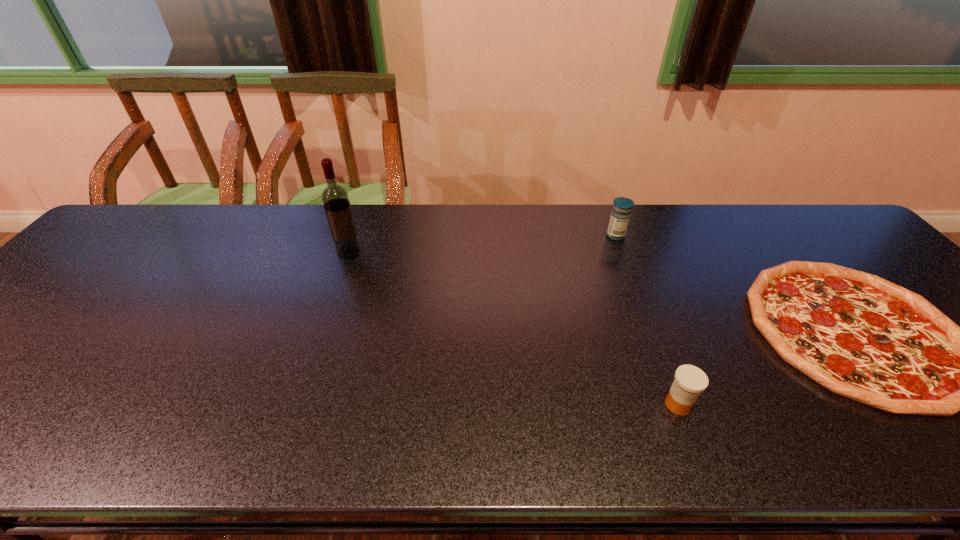
Where is `vacant space that is in between the farthest object and the second farthest object`? Image resolution: width=960 pixels, height=540 pixels. vacant space that is in between the farthest object and the second farthest object is located at coordinates (482, 244).

In order to click on vacant point located between the farthest object and the wine bottle in this screenshot , I will do `click(482, 244)`.

Find the location of a particular element. vacant area that lies between the shorter medicine and the farthest object is located at coordinates (647, 320).

Where is `object that is the third closest to the pizza`? The image size is (960, 540). object that is the third closest to the pizza is located at coordinates (335, 198).

This screenshot has width=960, height=540. I want to click on the third closest object to the wine bottle, so click(858, 335).

I want to click on vacant space that satisfies the following two spatial constraints: 1. on the back side of the third shortest object; 2. on the right side of the tallest object, so click(354, 235).